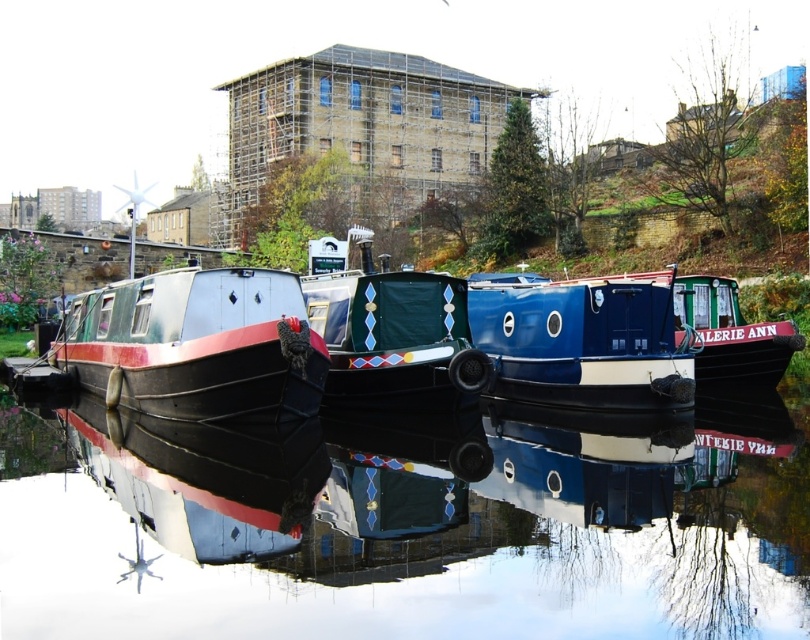
Is point (124, 294) positioned after point (695, 332)?

Yes, point (124, 294) is farther from viewer.

Based on the photo, who is more forward, [226,374] or [698,298]?

Point [226,374]

Locate an element on the screen. This screenshot has width=810, height=640. matte black boat at left is located at coordinates (197, 346).

Does glossy black water at center appear on the right side of matte blue and white boat at center?

Indeed, glossy black water at center is positioned on the right side of matte blue and white boat at center.

Does point (365, 458) come behind point (365, 262)?

No, (365, 458) is in front of (365, 262).

Is point (369, 516) less distant than point (395, 317)?

Yes, it is.

Locate an element on the screen. The width and height of the screenshot is (810, 640). glossy black water at center is located at coordinates (403, 529).

This screenshot has width=810, height=640. I want to click on matte black boat at left, so click(197, 346).

Is matte black boat at left below blue glossy boat at center?

Yes, matte black boat at left is below blue glossy boat at center.

The width and height of the screenshot is (810, 640). What do you see at coordinates (197, 346) in the screenshot? I see `matte black boat at left` at bounding box center [197, 346].

This screenshot has width=810, height=640. What are the coordinates of `matte black boat at left` in the screenshot? It's located at (197, 346).